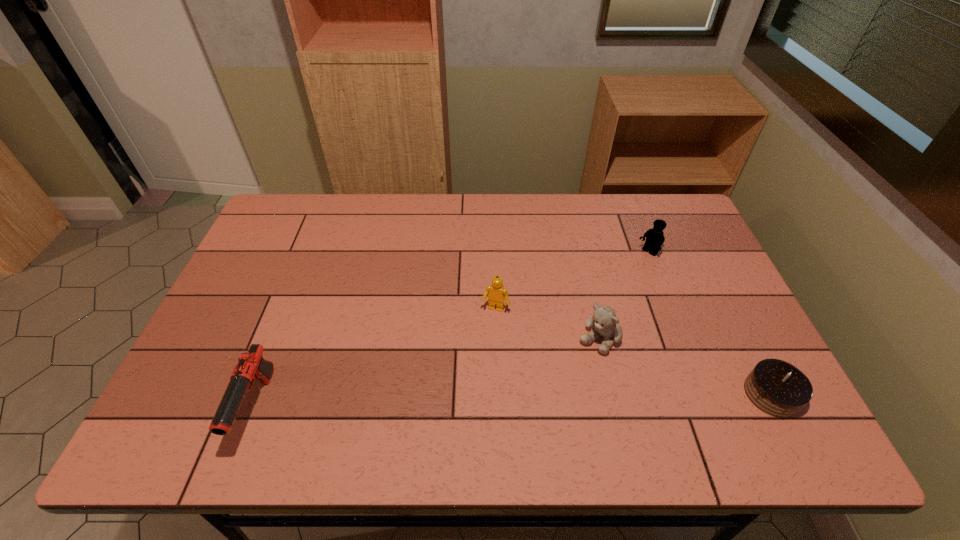
Where is `free space between the teddy bear and the gun`? The image size is (960, 540). free space between the teddy bear and the gun is located at coordinates click(427, 373).

At what (x,y) coordinates should I click in order to perform the action: click on unoccupied area between the chocolate cake and the leftmost object. Please return your answer as a coordinate pair (x, y). Looking at the image, I should click on (515, 401).

The height and width of the screenshot is (540, 960). Identify the location of empty space that is in between the farther Lego and the third object from right to left. (623, 296).

Find the location of `free space between the nearer Lego and the leftmost object`. free space between the nearer Lego and the leftmost object is located at coordinates (376, 358).

The image size is (960, 540). What are the coordinates of `free spot between the shortest object and the fourth object from left to right` in the screenshot? It's located at (709, 323).

Locate an element on the screen. unoccupied area between the gun and the left Lego is located at coordinates (376, 358).

Locate an element on the screen. This screenshot has height=540, width=960. blank region between the farthest object and the rightmost object is located at coordinates (709, 323).

Where is `vacant area between the farther Lego and the chocolate cake`? This screenshot has height=540, width=960. vacant area between the farther Lego and the chocolate cake is located at coordinates (709, 323).

I want to click on vacant area between the right Lego and the third object from left to right, so click(623, 296).

Locate an element on the screen. The width and height of the screenshot is (960, 540). free area in between the third nearest object and the second object from left to right is located at coordinates (546, 324).